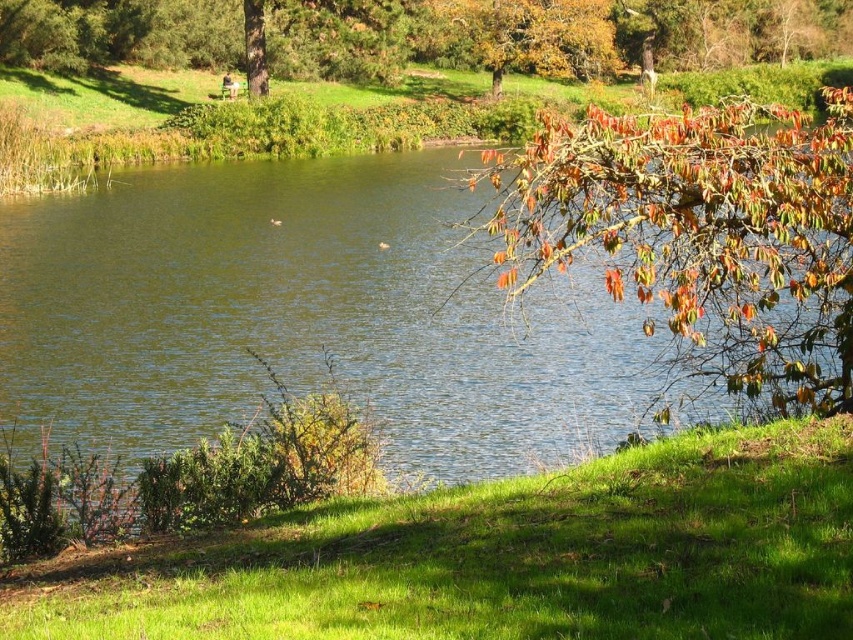
This screenshot has height=640, width=853. Describe the element at coordinates (306, 316) in the screenshot. I see `green reflective water at center` at that location.

Is green reflective water at center to the left of green grassy at lower left from the viewer's perspective?

Indeed, green reflective water at center is positioned on the left side of green grassy at lower left.

Identify the location of green reflective water at center. Image resolution: width=853 pixels, height=640 pixels. (306, 316).

Who is more distant from viewer, (519, 513) or (236, 88)?

Point (236, 88)

Measure the distance between green grassy at lower left and wooden park bench at upper center.

green grassy at lower left is 236.79 feet from wooden park bench at upper center.

What are the coordinates of `green grassy at lower left` in the screenshot? It's located at (502, 557).

Is brown leafy tree at upper center to the left of wooden park bench at upper center from the viewer's perspective?

In fact, brown leafy tree at upper center is to the right of wooden park bench at upper center.

Which is more to the left, brown leafy tree at upper center or wooden park bench at upper center?

wooden park bench at upper center

Who is more forward, (575,1) or (222,92)?

Point (222,92) is more forward.

Where is `brown leafy tree at upper center`? Image resolution: width=853 pixels, height=640 pixels. brown leafy tree at upper center is located at coordinates (421, 35).